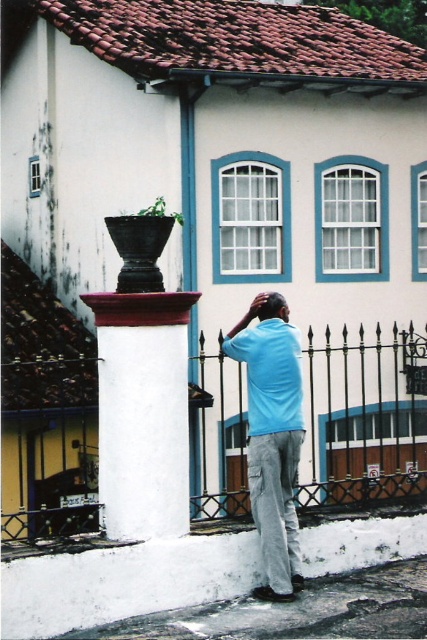
You are a painter who needs to paint the white painted stone column at center and the light blue cotton shirt at center. Which object should you paint first if you want to start with the one that is higher up?

The white painted stone column at center is above the light blue cotton shirt at center, so you should paint the white painted stone column at center first.